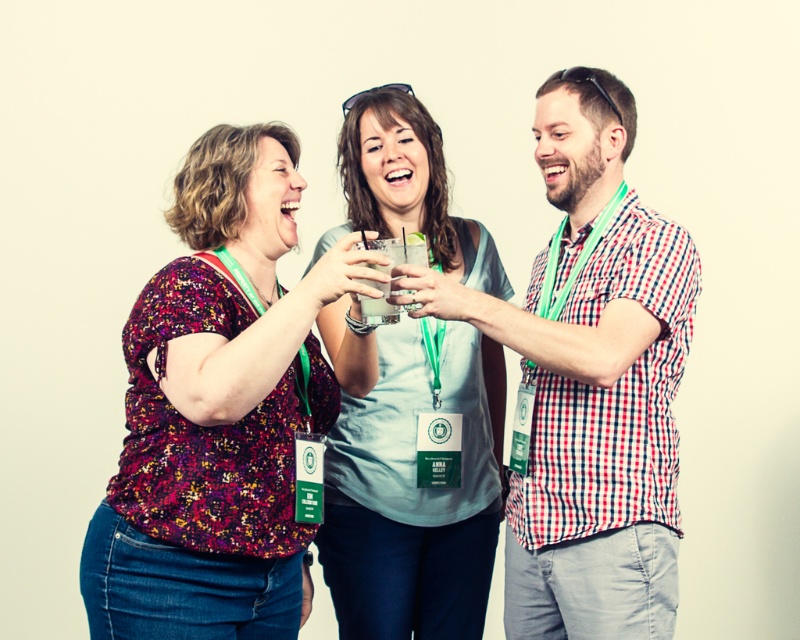
Question: Which point appears closest to the camera in this image?

Choices:
 (A) (290, 522)
 (B) (614, 346)

Answer: (B)

Question: Which of the following is the closest to the observer?

Choices:
 (A) light blue cotton shirt at center
 (B) floral print blouse at center
 (C) clear glass at center
 (D) checkered cotton shirt at center

Answer: (B)

Question: Based on their relative distances, which object is nearer to the light blue cotton shirt at center?

Choices:
 (A) clear glass at center
 (B) checkered cotton shirt at center

Answer: (A)

Question: Where is floral print blouse at center located in relation to light blue cotton shirt at center in the image?

Choices:
 (A) left
 (B) right

Answer: (A)

Question: Is floral print blouse at center further to the viewer compared to light blue cotton shirt at center?

Choices:
 (A) yes
 (B) no

Answer: (B)

Question: Is the position of floral print blouse at center less distant than that of checkered cotton shirt at center?

Choices:
 (A) no
 (B) yes

Answer: (B)